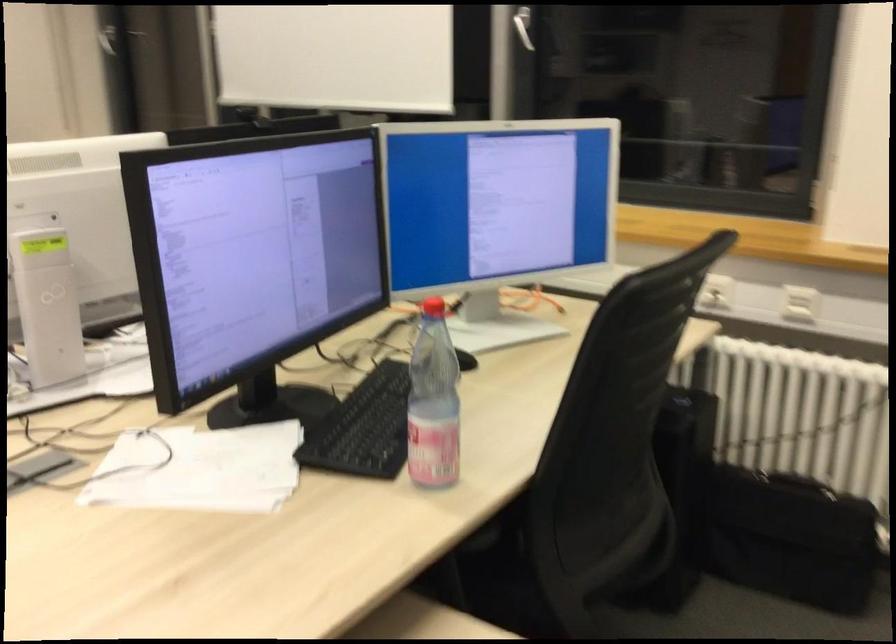
What do you see at coordinates (433, 402) in the screenshot? The width and height of the screenshot is (896, 644). I see `the red bottle cap` at bounding box center [433, 402].